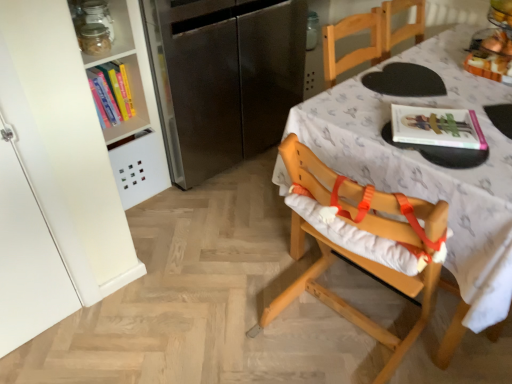
Question: From a real-world perspective, is clear glass jar at upper left physically above stainless steel refrigerator at left?

Choices:
 (A) yes
 (B) no

Answer: (A)

Question: Is clear glass jar at upper left thinner than stainless steel refrigerator at left?

Choices:
 (A) yes
 (B) no

Answer: (A)

Question: Considering the relative sizes of clear glass jar at upper left and stainless steel refrigerator at left in the image provided, is clear glass jar at upper left taller than stainless steel refrigerator at left?

Choices:
 (A) no
 (B) yes

Answer: (A)

Question: Is clear glass jar at upper left not inside stainless steel refrigerator at left?

Choices:
 (A) yes
 (B) no

Answer: (A)

Question: Does clear glass jar at upper left come in front of stainless steel refrigerator at left?

Choices:
 (A) no
 (B) yes

Answer: (A)

Question: Are clear glass jar at upper left and stainless steel refrigerator at left located far from each other?

Choices:
 (A) yes
 (B) no

Answer: (B)

Question: Is clear glass jar at upper left oriented away from wooden table at center?

Choices:
 (A) yes
 (B) no

Answer: (B)

Question: Considering the relative sizes of clear glass jar at upper left and wooden table at center in the image provided, is clear glass jar at upper left thinner than wooden table at center?

Choices:
 (A) yes
 (B) no

Answer: (A)

Question: Does clear glass jar at upper left have a larger size compared to wooden table at center?

Choices:
 (A) yes
 (B) no

Answer: (B)

Question: From a real-world perspective, is clear glass jar at upper left physically below wooden table at center?

Choices:
 (A) no
 (B) yes

Answer: (A)

Question: Can you confirm if clear glass jar at upper left is smaller than wooden table at center?

Choices:
 (A) yes
 (B) no

Answer: (A)

Question: From the image's perspective, is clear glass jar at upper left located beneath wooden table at center?

Choices:
 (A) yes
 (B) no

Answer: (B)

Question: Is wooden highchair at center far away from translucent glass bowl at upper right?

Choices:
 (A) yes
 (B) no

Answer: (B)